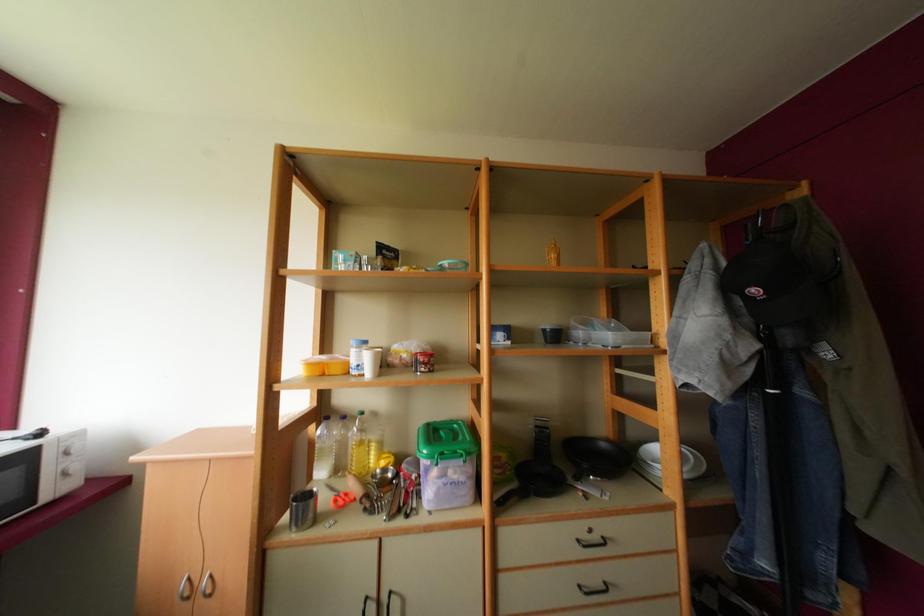
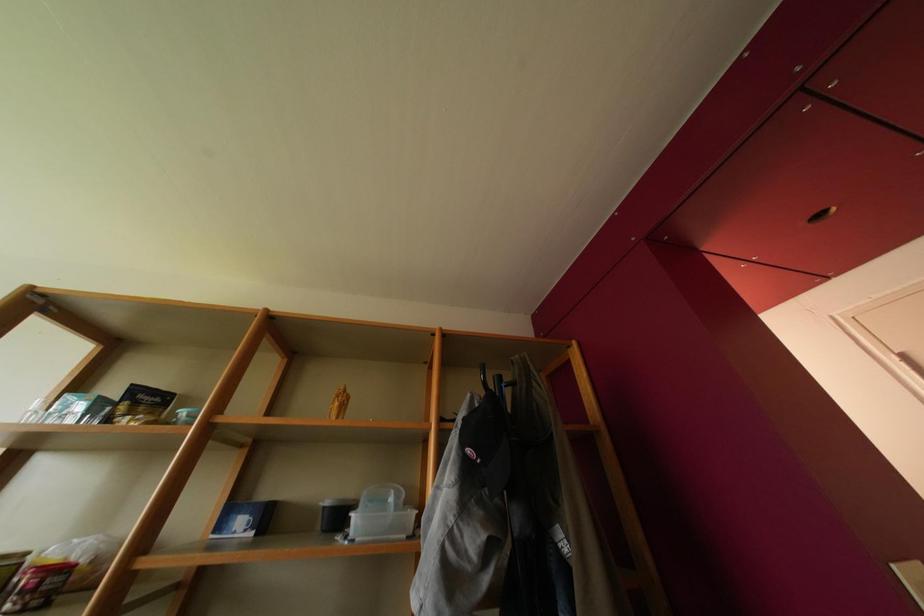
Question: The images are taken continuously from a first-person perspective. In which direction is your viewpoint rotating?

Choices:
 (A) Left
 (B) Right
 (C) Up
 (D) Down

Answer: (C)